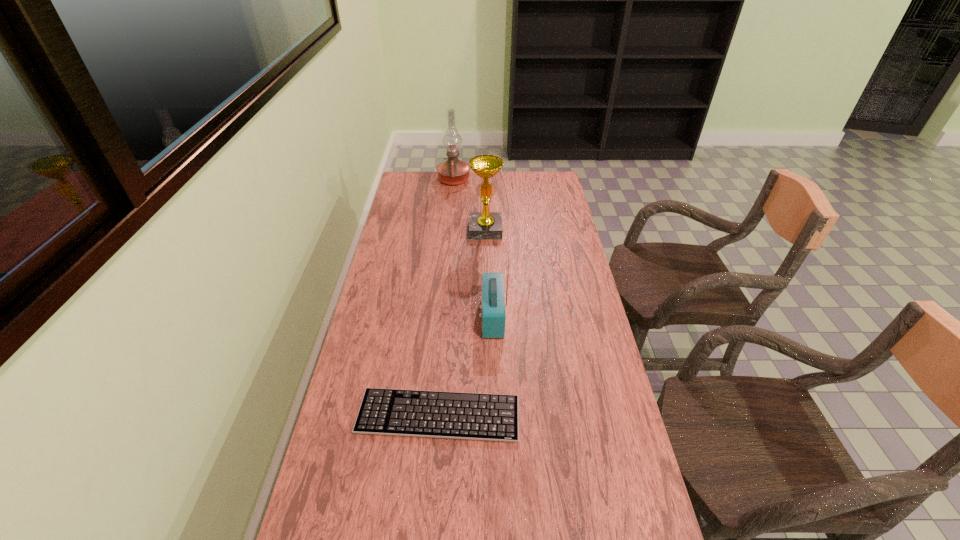
This screenshot has height=540, width=960. What are the coordinates of `vacant space that's between the nearest object and the third farthest object` in the screenshot? It's located at (466, 366).

You are a GUI agent. You are given a task and a screenshot of the screen. Output one action in this format:
    pyautogui.click(x=<x>, y=<y>)
    Task: Click on the free space that is in between the oil lamp and the radio receiver
    The image size is (960, 540).
    Given the screenshot: What is the action you would take?
    pyautogui.click(x=473, y=248)

This screenshot has width=960, height=540. I want to click on blank region between the farthest object and the nearest object, so click(446, 298).

At what (x,y) coordinates should I click in order to perform the action: click on free space between the oil lamp and the radio receiver. Please return your answer as a coordinate pair (x, y). This screenshot has width=960, height=540. Looking at the image, I should click on (473, 248).

Locate an element on the screen. the second closest object relative to the award is located at coordinates (493, 315).

Point out which object is positioned as the nearest to the second farthest object. Please provide its 2D coordinates. Your answer should be formatted as a tuple, i.e. [(x, y)], where the tuple contains the x and y coordinates of a point satisfying the conditions above.

[(453, 171)]

Find the location of `free space in the image that satisfies the following two spatial constraints: 1. on the front side of the nearest object; 2. on the right side of the farthest object`. free space in the image that satisfies the following two spatial constraints: 1. on the front side of the nearest object; 2. on the right side of the farthest object is located at coordinates (433, 415).